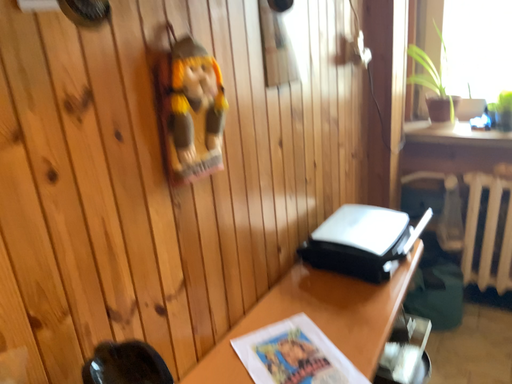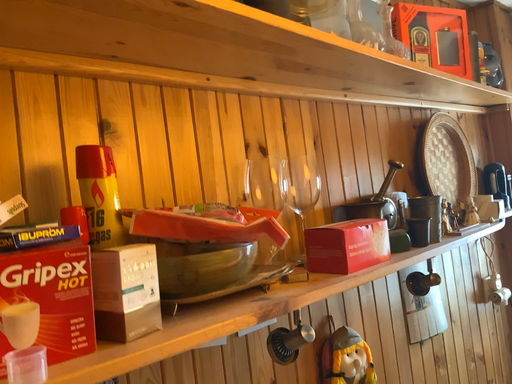
Question: Which way did the camera rotate in the video?

Choices:
 (A) rotated downward
 (B) rotated upward

Answer: (B)